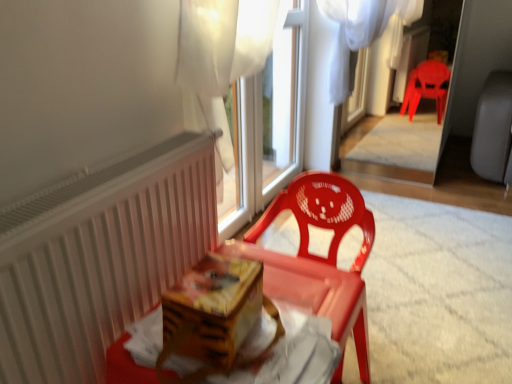
Question: Can you confirm if matte plastic chair at center is wider than white plastic window frame at upper center?

Choices:
 (A) yes
 (B) no

Answer: (A)

Question: Is matte plastic chair at center to the left of white plastic window frame at upper center from the viewer's perspective?

Choices:
 (A) yes
 (B) no

Answer: (A)

Question: Would you say matte plastic chair at center is a long distance from white plastic window frame at upper center?

Choices:
 (A) no
 (B) yes

Answer: (B)

Question: Is matte plastic chair at center further to camera compared to white plastic window frame at upper center?

Choices:
 (A) yes
 (B) no

Answer: (B)

Question: Can we say matte plastic chair at center lies outside white plastic window frame at upper center?

Choices:
 (A) yes
 (B) no

Answer: (A)

Question: From a real-world perspective, is white plastic window frame at upper center physically located above or below matte plastic chair at center?

Choices:
 (A) below
 (B) above

Answer: (B)

Question: In the image, is white plastic window frame at upper center on the left side or the right side of matte plastic chair at center?

Choices:
 (A) right
 (B) left

Answer: (A)

Question: Which is correct: white plastic window frame at upper center is inside matte plastic chair at center, or outside of it?

Choices:
 (A) inside
 (B) outside

Answer: (B)

Question: In terms of height, does white plastic window frame at upper center look taller or shorter compared to matte plastic chair at center?

Choices:
 (A) tall
 (B) short

Answer: (A)

Question: From a real-world perspective, is white plastic window frame at upper center positioned above or below white sheer curtain at upper center?

Choices:
 (A) above
 (B) below

Answer: (A)

Question: From the image's perspective, is white plastic window frame at upper center positioned above or below white sheer curtain at upper center?

Choices:
 (A) below
 (B) above

Answer: (B)

Question: Is white plastic window frame at upper center spatially inside white sheer curtain at upper center, or outside of it?

Choices:
 (A) outside
 (B) inside

Answer: (B)

Question: In terms of size, does white plastic window frame at upper center appear bigger or smaller than white sheer curtain at upper center?

Choices:
 (A) big
 (B) small

Answer: (B)

Question: In the image, is white plastic window frame at upper center on the left side or the right side of white matte radiator at left?

Choices:
 (A) left
 (B) right

Answer: (B)

Question: Would you say white plastic window frame at upper center is inside or outside white matte radiator at left?

Choices:
 (A) outside
 (B) inside

Answer: (A)